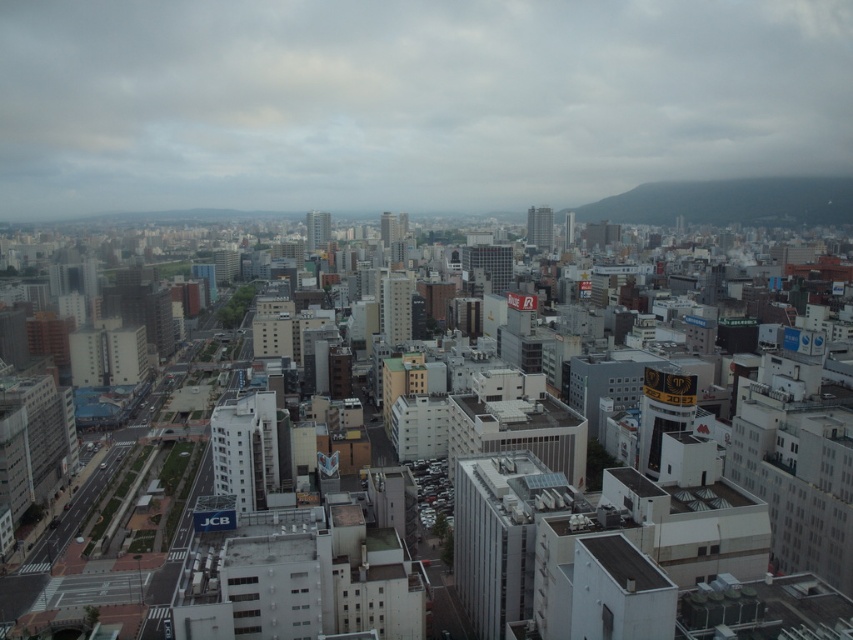
How distant is white matte building at center from green grassy hill at upper right?

They are 1391.68 feet apart.

Is the position of white matte building at center more distant than that of green grassy hill at upper right?

No, it is in front of green grassy hill at upper right.

In order to click on white matte building at center in this screenshot , I will do `click(587, 516)`.

Locate an element on the screen. This screenshot has width=853, height=640. white matte building at center is located at coordinates (587, 516).